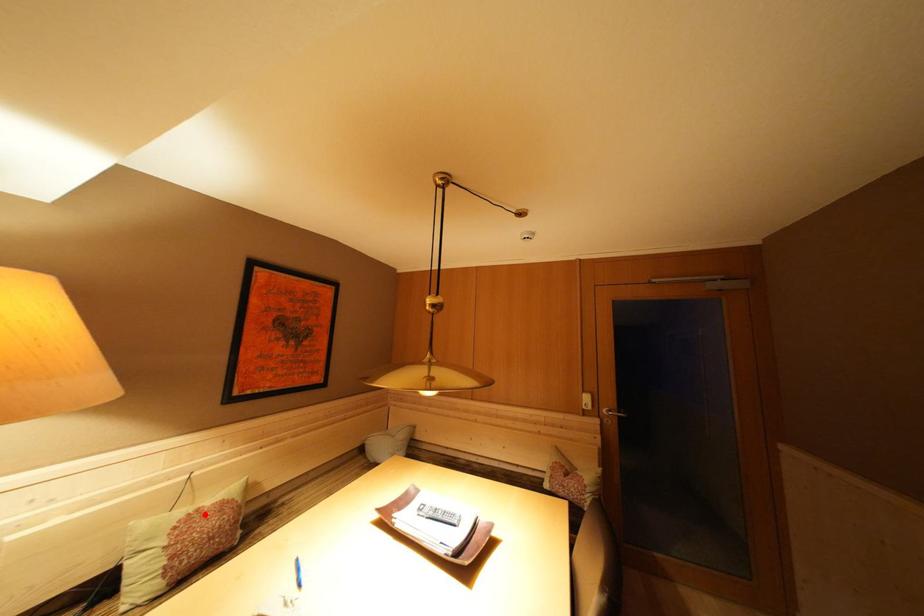
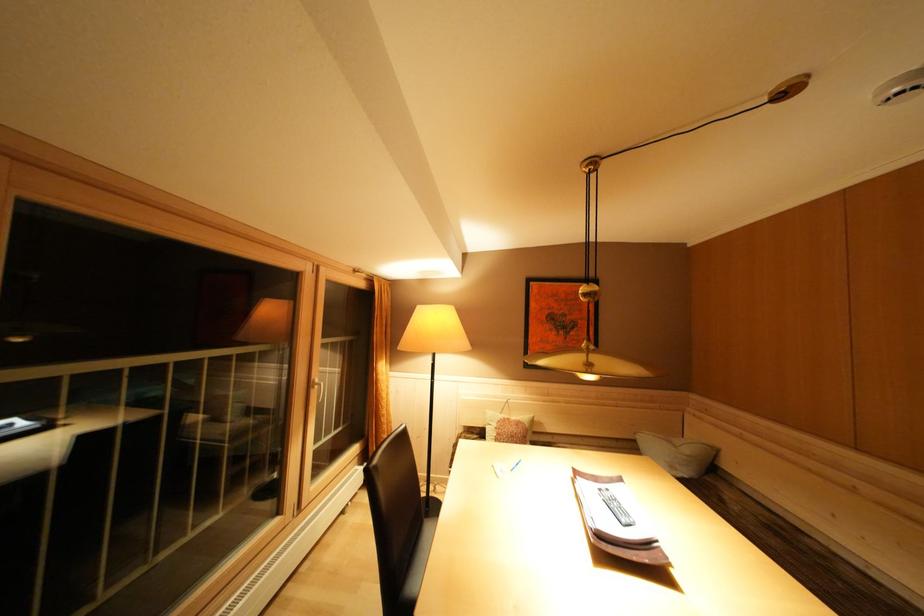
Question: I am providing you with two images of the same scene from different viewpoints. A red point is shown in image1. For the corresponding object point in image2, is it positioned nearer or farther from the camera?

Choices:
 (A) Nearer
 (B) Farther

Answer: (B)